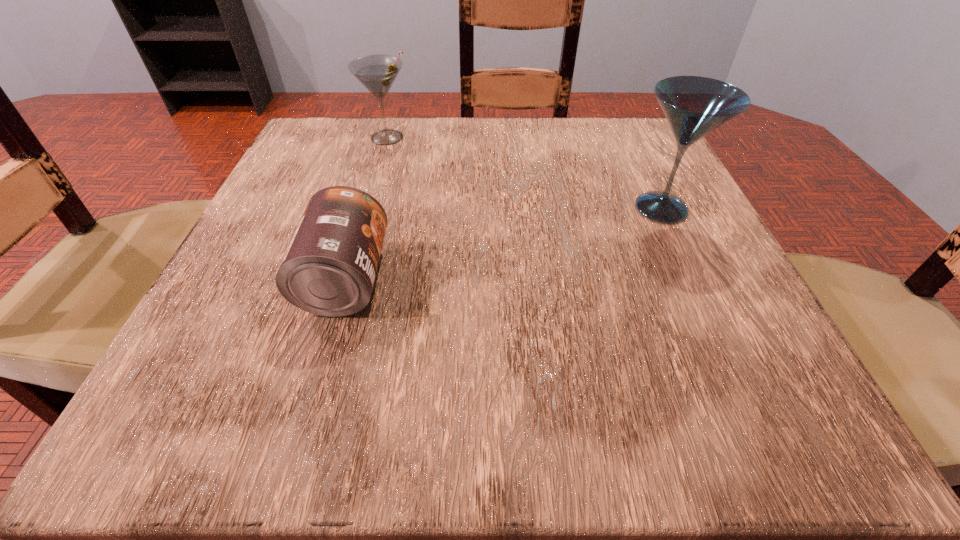
This screenshot has height=540, width=960. Find the location of `the right martini`. the right martini is located at coordinates (694, 106).

At what (x,y) coordinates should I click in order to perform the action: click on the second farthest object. Please return your answer as a coordinate pair (x, y). The image size is (960, 540). Looking at the image, I should click on (694, 106).

Find the location of a particular element. the second tallest object is located at coordinates (377, 73).

The height and width of the screenshot is (540, 960). I want to click on the left martini, so click(x=377, y=73).

You are a GUI agent. You are given a task and a screenshot of the screen. Output one action in this format:
    pyautogui.click(x=<x>, y=<y>)
    Task: Click on the shortest object
    This screenshot has width=960, height=540.
    Given the screenshot: What is the action you would take?
    pyautogui.click(x=329, y=269)

Where is `can`? This screenshot has width=960, height=540. can is located at coordinates (329, 269).

Locate an element on the screen. This screenshot has width=960, height=540. blank space located 0.230m on the front of the nearer martini is located at coordinates (730, 355).

Locate an element on the screen. The height and width of the screenshot is (540, 960). vacant space located 0.340m on the front of the farthest object is located at coordinates (348, 273).

Where is `free space located 0.120m on the front label of the shortest object`? free space located 0.120m on the front label of the shortest object is located at coordinates (470, 279).

You are a GUI agent. You are given a task and a screenshot of the screen. Output one action in this format:
    pyautogui.click(x=<x>, y=<y>)
    Task: Click on the object that is at the far edge
    This screenshot has height=540, width=960.
    Given the screenshot: What is the action you would take?
    pyautogui.click(x=377, y=73)